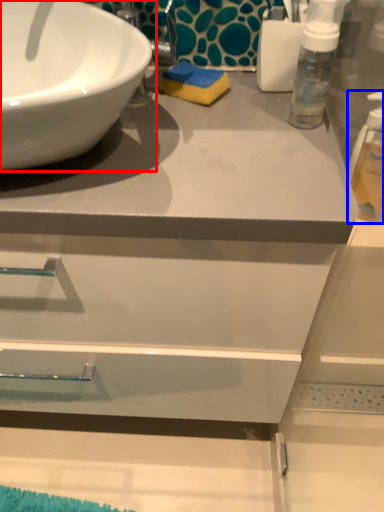
Question: Which point is further to the camera, sink (highlighted by a red box) or cleaning product (highlighted by a blue box)?

Choices:
 (A) sink
 (B) cleaning product

Answer: (B)